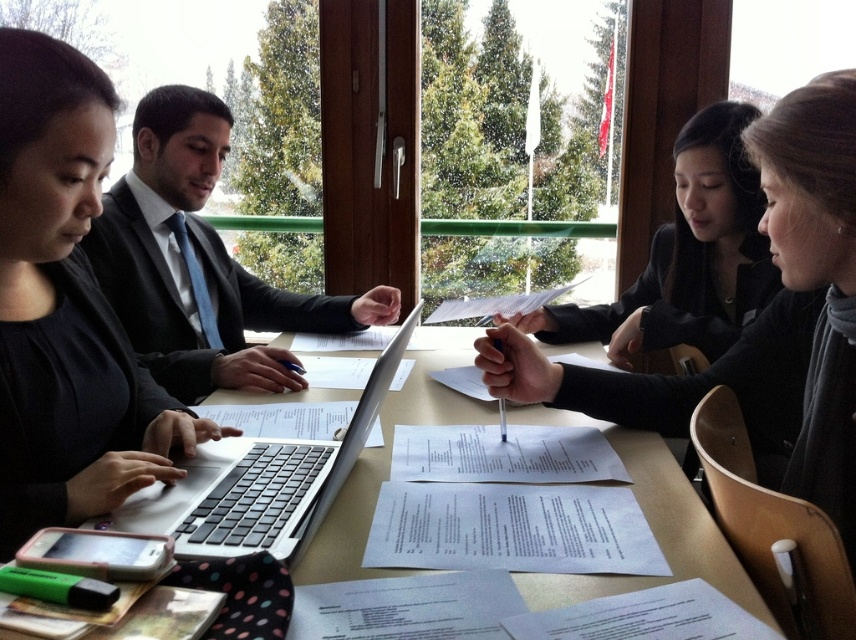
Can you confirm if silver/black matte laptop at center is shorter than matte silver laptop at center?

No.

Which is behind, point (251, 541) or point (131, 630)?

Positioned behind is point (251, 541).

Is point (111, 528) farther from camera compared to point (633, 589)?

Yes.

Where is `silver/black matte laptop at center`? silver/black matte laptop at center is located at coordinates (260, 483).

How far apart are matte black suit at center and black matte jacket at upper right?

matte black suit at center and black matte jacket at upper right are 69.37 centimeters apart from each other.

Between matte black suit at center and black matte jacket at upper right, which one appears on the right side from the viewer's perspective?

black matte jacket at upper right is more to the right.

What do you see at coordinates (199, 262) in the screenshot? I see `matte black suit at center` at bounding box center [199, 262].

What are the coordinates of `matte black suit at center` in the screenshot? It's located at (199, 262).

Is matte black laptop at left above silver/black matte laptop at center?

Yes.

Who is more distant from viewer, (16, 108) or (277, 548)?

Point (16, 108)

Between point (4, 321) and point (253, 481), which one is positioned behind?

Point (4, 321)

Where is `matte black laptop at left`? The image size is (856, 640). matte black laptop at left is located at coordinates (66, 308).